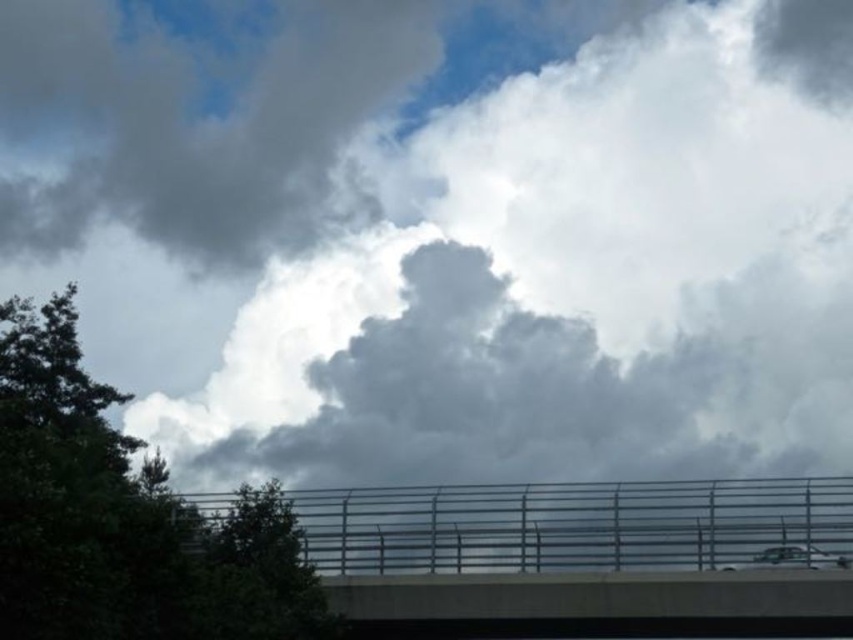
Is concrete overpass at center further to camera compared to green leafy tree at upper left?

Yes, concrete overpass at center is further from the viewer.

Can you confirm if concrete overpass at center is bigger than green leafy tree at upper left?

Incorrect, concrete overpass at center is not larger than green leafy tree at upper left.

Find the location of a particular element. This screenshot has height=640, width=853. concrete overpass at center is located at coordinates (576, 528).